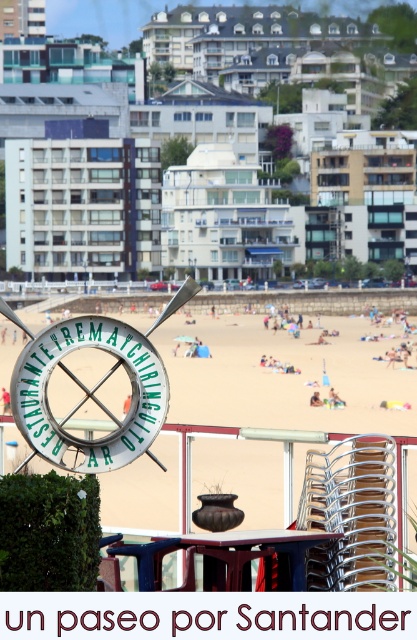
Who is higher up, beige sand at center or green metallic sign at center?

beige sand at center is above.

Which is behind, point (364, 440) or point (34, 362)?

Point (34, 362)

Identify the location of beige sand at center. The height and width of the screenshot is (640, 417). (226, 435).

The height and width of the screenshot is (640, 417). Find the location of `beige sand at center`. beige sand at center is located at coordinates (226, 435).